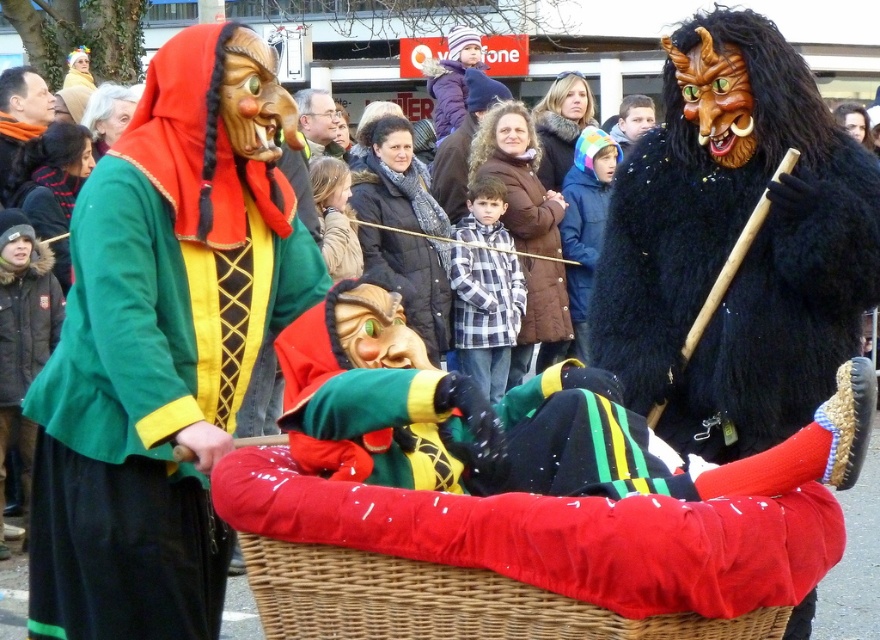
You are a photographer trying to capture a clear shot of the glossy plastic glasses at center and the smooth brown leather jacket at upper center. Which object should you zoom in on to ensure it fills the frame without cropping?

The glossy plastic glasses at center is bigger than the smooth brown leather jacket at upper center, so you should zoom in on the glossy plastic glasses at center to ensure it fills the frame without cropping.